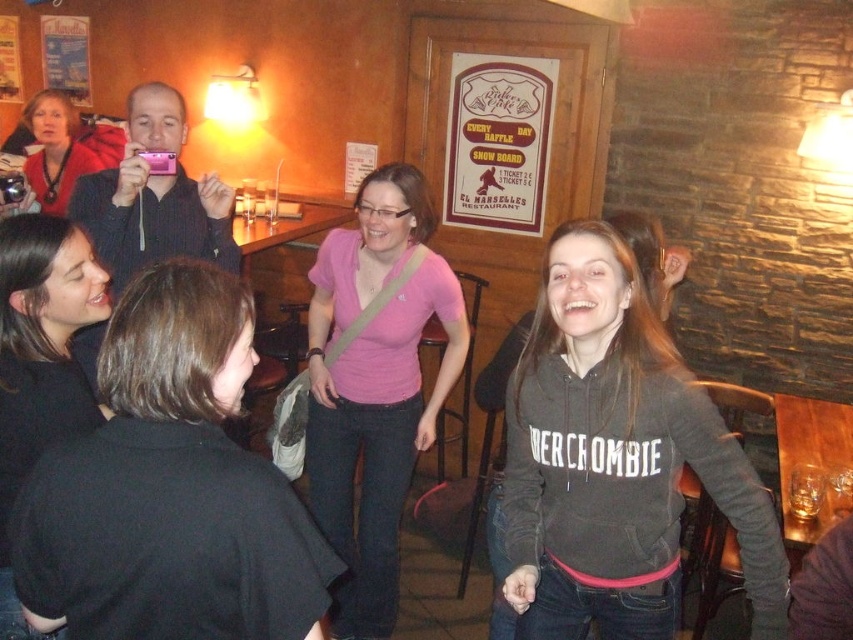
Does pink matte t-shirt at center have a smaller size compared to black matte jacket at lower left?

No.

Can you confirm if pink matte t-shirt at center is bigger than black matte jacket at lower left?

Yes, pink matte t-shirt at center is bigger than black matte jacket at lower left.

At what (x,y) coordinates should I click in order to perform the action: click on pink matte t-shirt at center. Please return your answer as a coordinate pair (x, y). The height and width of the screenshot is (640, 853). Looking at the image, I should click on (374, 387).

From the picture: Is black matte shirt at center smaller than pink matte t-shirt at center?

Yes.

Who is lower down, black matte shirt at center or pink matte t-shirt at center?

pink matte t-shirt at center is lower down.

At what (x,y) coordinates should I click in order to perform the action: click on black matte shirt at center. Please return your answer as a coordinate pair (x, y). The image size is (853, 640). Looking at the image, I should click on (170, 488).

Is black hoodie at center wider than matte black jacket at upper left?

Yes.

Does black hoodie at center appear under matte black jacket at upper left?

Indeed, black hoodie at center is positioned under matte black jacket at upper left.

Where is `black hoodie at center`? This screenshot has width=853, height=640. black hoodie at center is located at coordinates (616, 460).

You are a GUI agent. You are given a task and a screenshot of the screen. Output one action in this format:
    pyautogui.click(x=<x>, y=<y>)
    Task: Click on the black hoodie at center
    This screenshot has width=853, height=640.
    Given the screenshot: What is the action you would take?
    pyautogui.click(x=616, y=460)